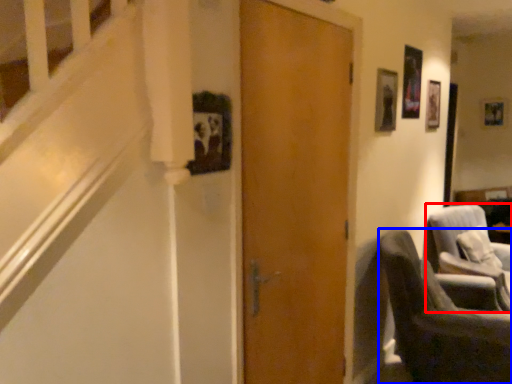
Question: Which point is further to the camera, chair (highlighted by a red box) or chair (highlighted by a blue box)?

Choices:
 (A) chair
 (B) chair

Answer: (A)